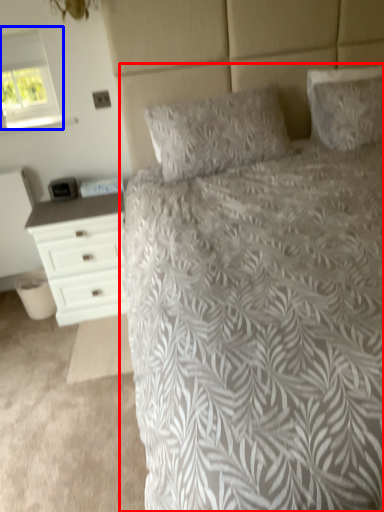
Question: Among these objects, which one is farthest to the camera, bed (highlighted by a red box) or window (highlighted by a blue box)?

Choices:
 (A) bed
 (B) window

Answer: (B)